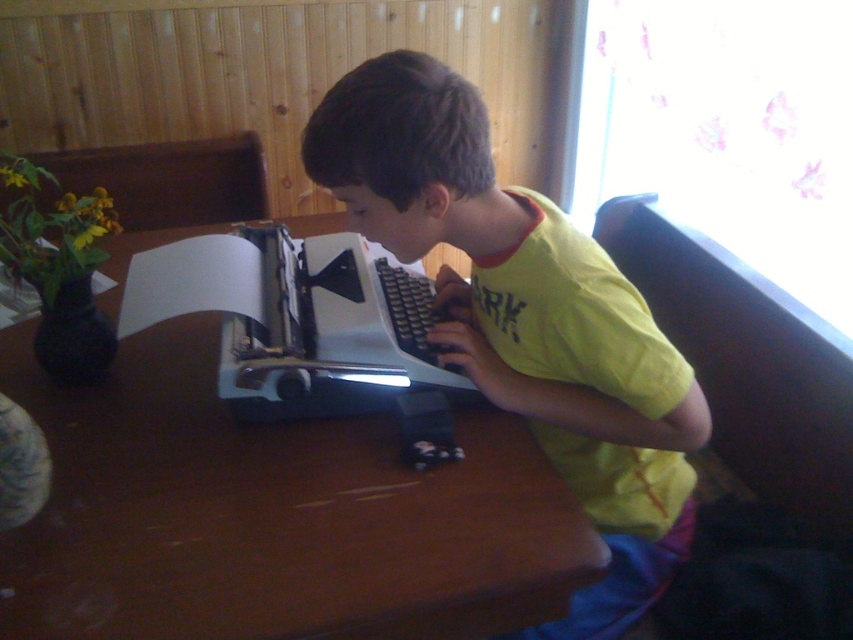
You are a photographer setting up a shoot. You need to position a light source to the right of the yellow cotton shirt at center to highlight it. Based on the scene, where should you place the light source relative to the brown wooden table at center?

The brown wooden table at center is to the left of the yellow cotton shirt at center. To place the light source to the right of the yellow cotton shirt at center, you should position it to the right of the yellow cotton shirt at center, which would be the opposite side of the brown wooden table at center.

You are a tailor measuring a yellow cotton shirt at center to fit on a brown wooden table at center. Can you determine if the shirt will fit on the table?

The brown wooden table at center might be wider than yellow cotton shirt at center, so there is a possibility that the shirt can fit on the table. However, without exact measurements, it is uncertain.